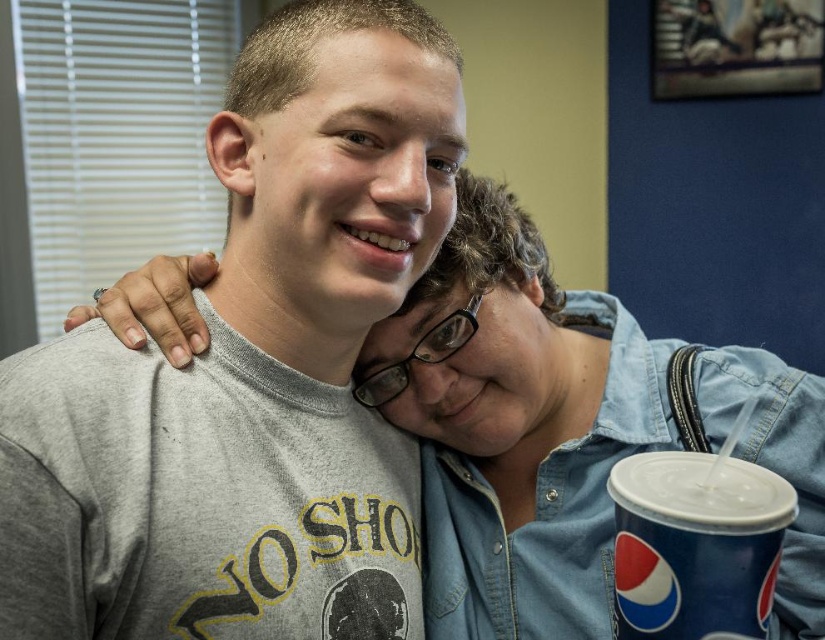
You are a photographer standing at the point marked by the coordinate point at point (201, 372). You want to take a photo of both people so that they are in focus. The camera you are using has a depth of field that can cover 30 inches. Will both people be in focus in the photo?

The two people are 29.04 inches apart, which is within the camera depth of field of 30 inches, so both will be in focus.